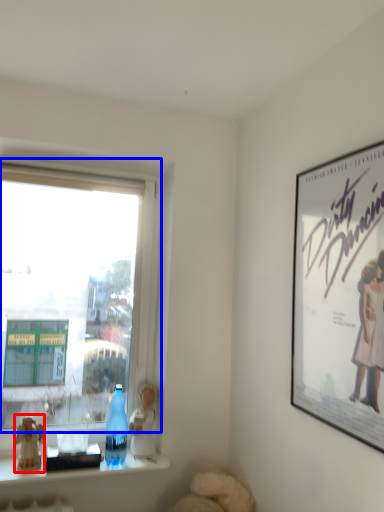
Question: Which object appears farthest to the camera in this image, figurine (highlighted by a red box) or window (highlighted by a blue box)?

Choices:
 (A) figurine
 (B) window

Answer: (A)